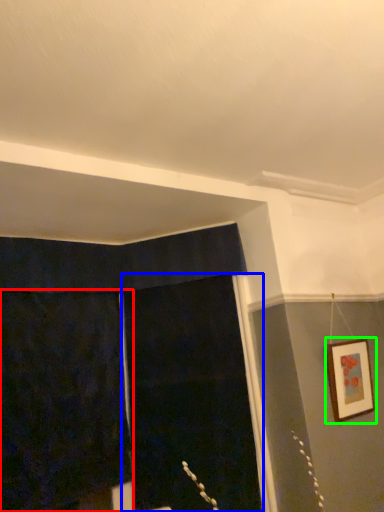
Question: Which object is positioned closest to curtain (highlighted by a red box)? Select from screen door (highlighted by a blue box) and picture frame (highlighted by a green box).

Choices:
 (A) screen door
 (B) picture frame

Answer: (A)